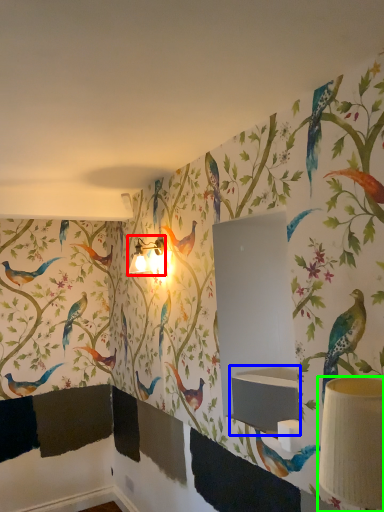
Question: Which object is positioned closest to table lamp (highlighted by a red box)? Select from sink (highlighted by a blue box) and table lamp (highlighted by a green box).

Choices:
 (A) sink
 (B) table lamp

Answer: (A)